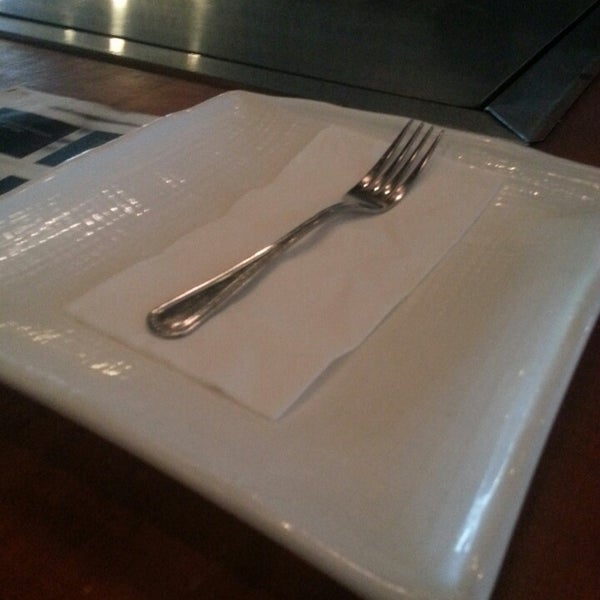
What are the coordinates of `square white plate` in the screenshot? It's located at 383,408.